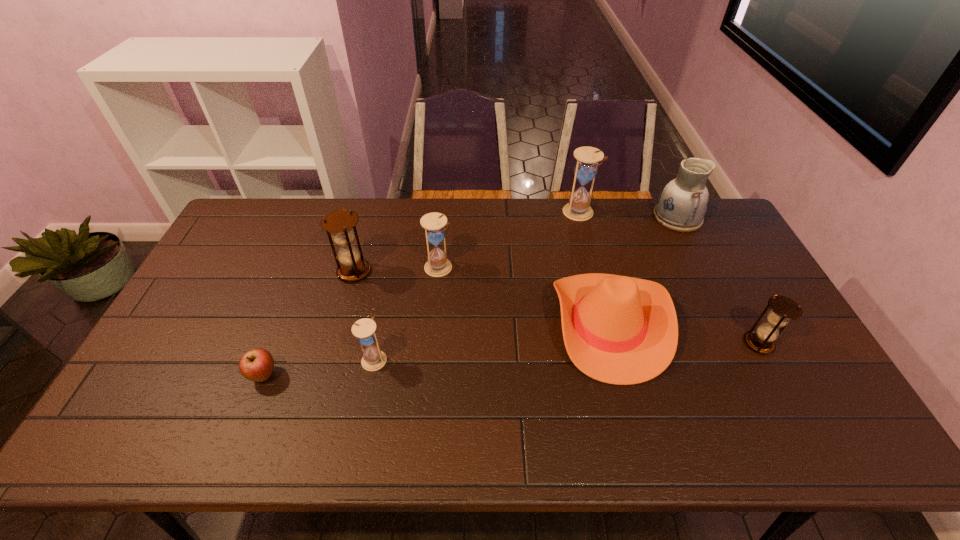
In order to click on the smallest white hourglass in this screenshot , I will do `click(373, 359)`.

Identify the location of the third object from left to right. The width and height of the screenshot is (960, 540). (373, 359).

This screenshot has height=540, width=960. In order to click on the shortest object in this screenshot , I will do `click(256, 365)`.

Locate an element on the screen. Image resolution: width=960 pixels, height=540 pixels. red apple is located at coordinates (256, 365).

Find the location of a particular element. vacant area situated 0.080m on the left of the rightmost white hourglass is located at coordinates (541, 213).

At what (x,y) coordinates should I click in order to perform the action: click on vacant area located on the left of the blue pottery. Please return your answer as a coordinate pair (x, y). The image size is (960, 540). Looking at the image, I should click on (582, 217).

At what (x,y) coordinates should I click in order to perform the action: click on free space located 0.160m on the left of the leftmost hourglass. Please return your answer as a coordinate pair (x, y). The height and width of the screenshot is (540, 960). Looking at the image, I should click on (287, 272).

Where is `free space located on the back of the second white hourglass from right to left`? free space located on the back of the second white hourglass from right to left is located at coordinates pyautogui.click(x=444, y=210).

Where is `free location located 0.120m on the left of the cowboy hat`? This screenshot has height=540, width=960. free location located 0.120m on the left of the cowboy hat is located at coordinates (512, 324).

The height and width of the screenshot is (540, 960). Identify the location of free space located 0.110m on the left of the nearer brown hourglass. (704, 344).